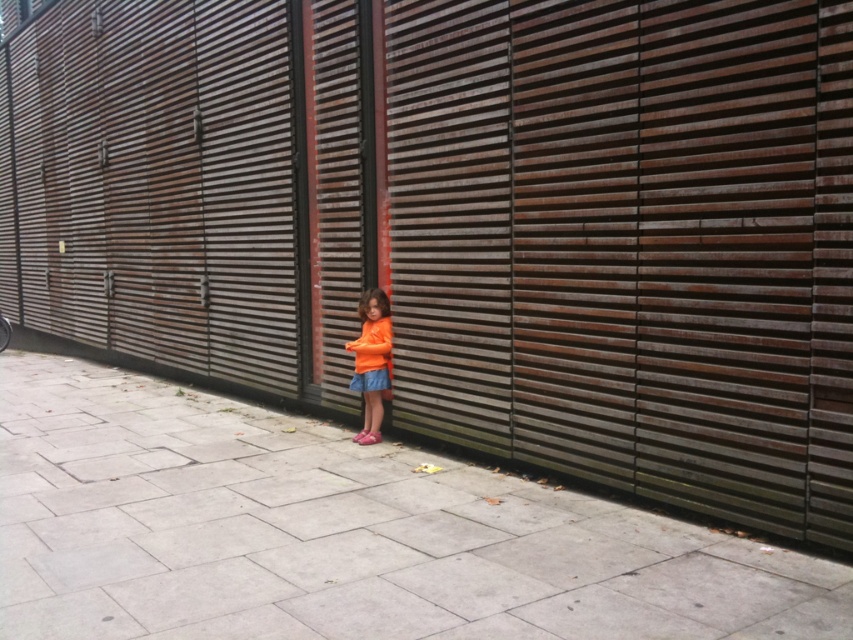
Question: Is orange matte shirt at center below orange fabric shorts at center?

Choices:
 (A) yes
 (B) no

Answer: (B)

Question: Can you confirm if gray concrete pavement at center is wider than orange fabric shorts at center?

Choices:
 (A) yes
 (B) no

Answer: (B)

Question: Does gray concrete pavement at center lie behind orange fabric shorts at center?

Choices:
 (A) no
 (B) yes

Answer: (A)

Question: Among these points, which one is farthest from the camera?

Choices:
 (A) (376, 332)
 (B) (372, 385)
 (C) (4, 531)

Answer: (A)

Question: Based on their relative distances, which object is nearer to the orange matte shirt at center?

Choices:
 (A) gray concrete pavement at center
 (B) orange fabric shorts at center

Answer: (B)

Question: Which object is positioned closest to the orange fabric shorts at center?

Choices:
 (A) gray concrete pavement at center
 (B) orange matte shirt at center

Answer: (B)